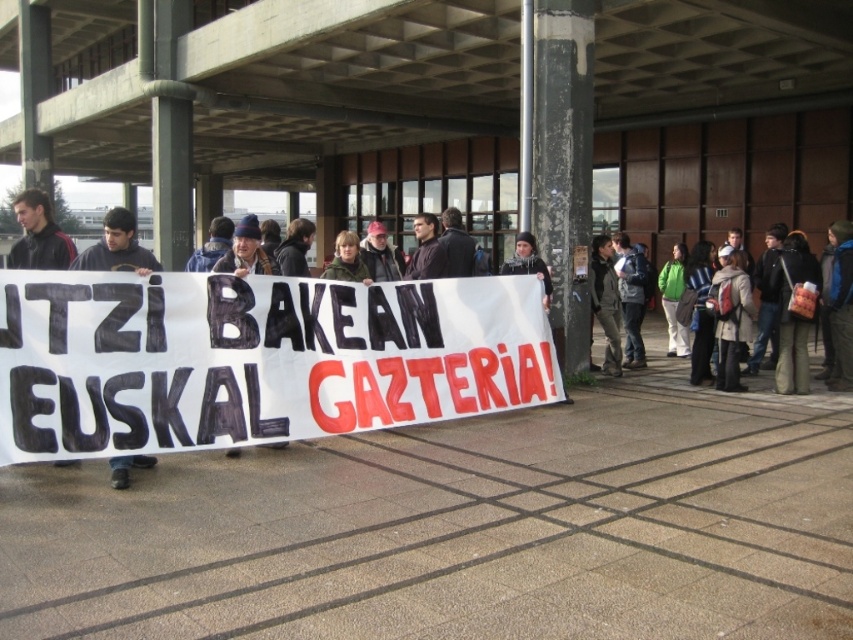
You are a photographer trying to capture a photo of the protest scene. You notice the white woolen hat at center and the matte black jacket at left. Which object should you focus on first if you want to ensure both are in the frame without adjusting your camera angle?

You should focus on the white woolen hat at center first because it is shorter than the matte black jacket at left. Since it has a lesser height, you can position your camera to include both by starting with the lower object and ensuring the taller one doesn

You are a photographer standing at the camera position. You want to capture a closeup shot of the white woolen hat at center. Given that your camera can focus on objects within 10 feet, will you be able to take the photo without moving closer?

The white woolen hat at center is 29.41 feet away from the camera, which is beyond the 10 feet focusing range. Therefore, you cannot take a closeup shot without moving closer.

You are a photographer trying to capture a photo of the black fabric sign at left and the red fabric sign at right in the protest scene. The camera you are using has a maximum focus range of 15 feet. Can you take a photo that includes both signs clearly in focus?

The black fabric sign at left and the red fabric sign at right are 18.22 feet apart. Since the camera can only focus up to 15 feet, the distance between them exceeds the focus range. Therefore, you cannot take a photo with both signs clearly in focus.